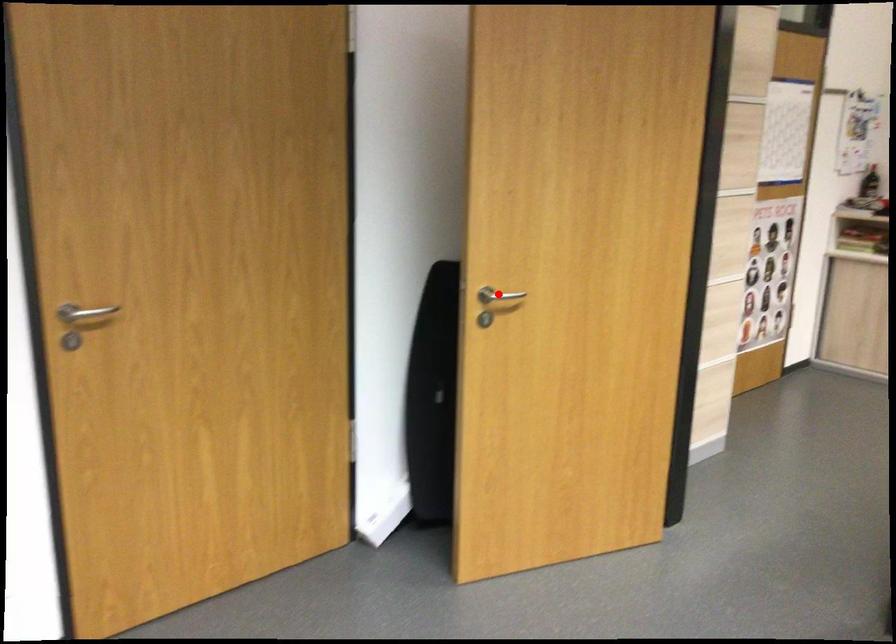
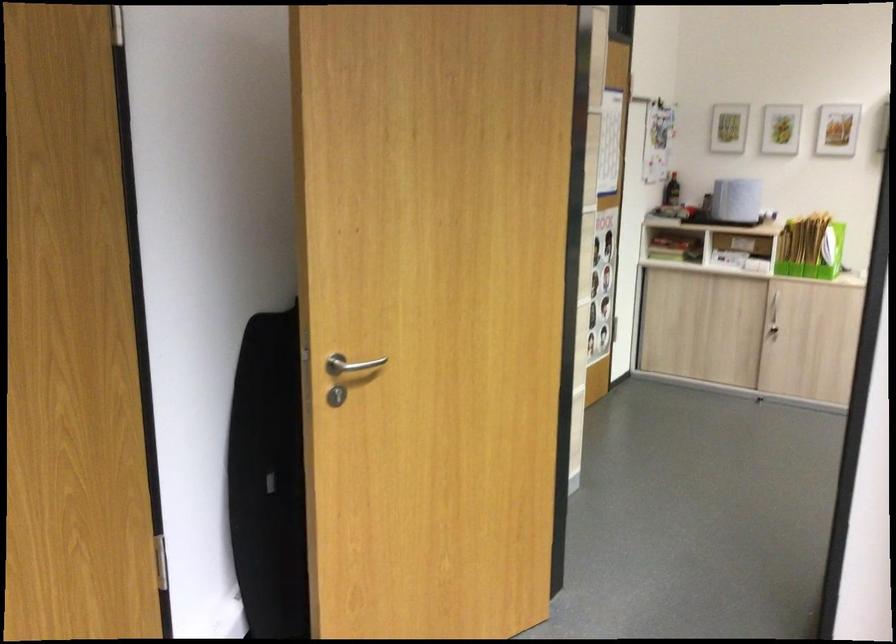
Locate, in the second image, the point that corresponds to the highlighted location in the first image.

(350, 365)